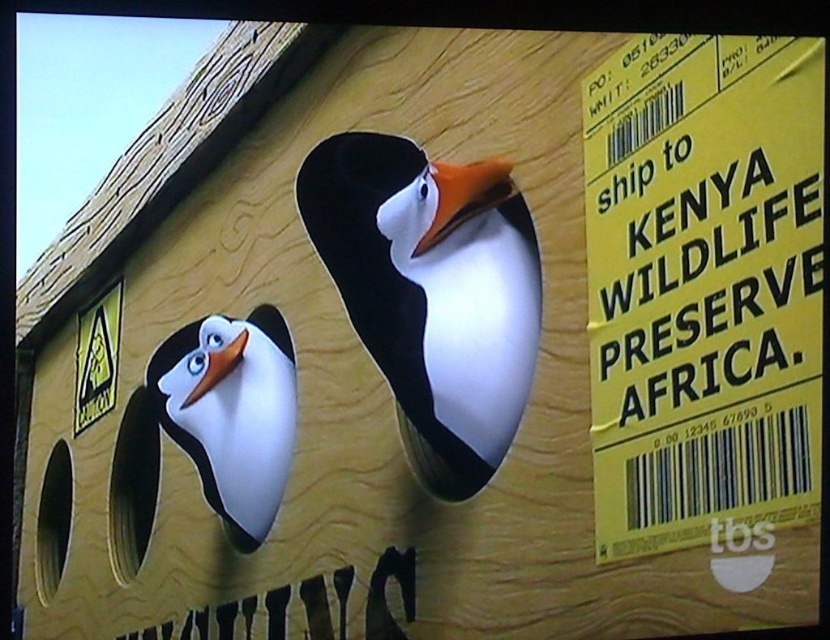
You are a penguin in the animated scene. You see the yellow paper at right and the orange matte beak at center. Which object is closer to the bottom edge of the screen?

The yellow paper at right is located below the orange matte beak at center, so it is closer to the bottom edge of the screen.

You are a penguin standing at the orange matte beak at center and want to grab the yellow paper at right. Given that your beak can reach 1.4 meters, can you reach it?

The yellow paper at right is 1.41 meters from the orange matte beak at center. Since your beak can only reach 1.4 meters, you cannot reach it.